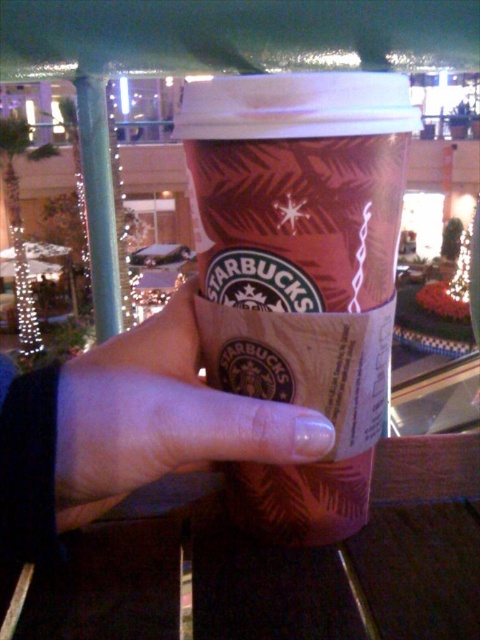
Question: Can you confirm if matte paper cup at center is positioned to the right of nail polish at center?

Choices:
 (A) yes
 (B) no

Answer: (A)

Question: Which point appears closest to the camera in this image?

Choices:
 (A) (287, 180)
 (B) (189, 332)

Answer: (A)

Question: Which object is closer to the camera taking this photo?

Choices:
 (A) nail polish at center
 (B) matte paper cup at center

Answer: (B)

Question: Is matte paper cup at center above nail polish at center?

Choices:
 (A) no
 (B) yes

Answer: (B)

Question: Is matte paper cup at center further to camera compared to nail polish at center?

Choices:
 (A) yes
 (B) no

Answer: (B)

Question: Which point is closer to the camera taking this photo?

Choices:
 (A) (104, 497)
 (B) (403, 83)

Answer: (A)